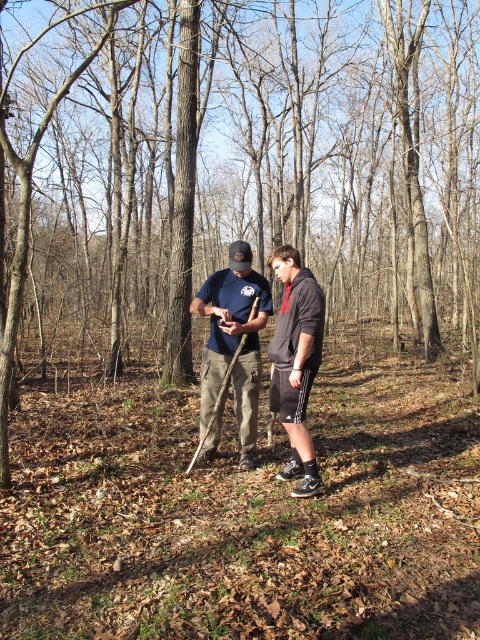
Is dark gray hoodie at center bigger than black matte hoodie at center?

Yes.

Who is more forward, (296, 348) or (317, 321)?

Point (317, 321) is more forward.

I want to click on dark gray hoodie at center, so click(x=233, y=340).